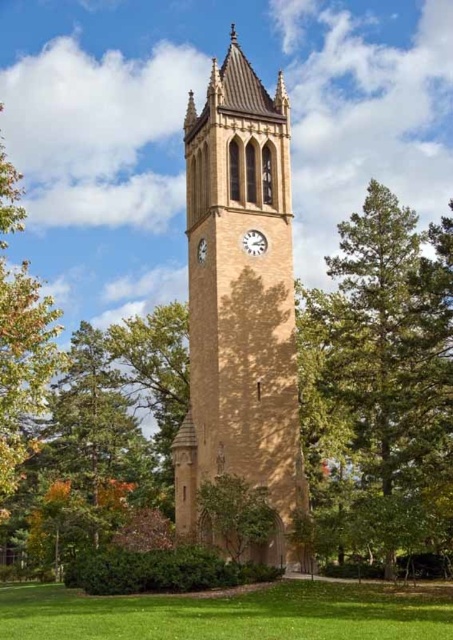
Question: Can you confirm if green leafy tree at lower center is wider than metallic silver clock at center?

Choices:
 (A) yes
 (B) no

Answer: (B)

Question: Observing the image, what is the correct spatial positioning of yellow stone clock tower at center in reference to green leafy tree at left?

Choices:
 (A) above
 (B) below

Answer: (A)

Question: Considering the real-world distances, which object is closest to the metallic silver clock at center?

Choices:
 (A) green leafy tree at right
 (B) green grass at lower center

Answer: (A)

Question: Is green grass at lower center below green leafy tree at left?

Choices:
 (A) yes
 (B) no

Answer: (A)

Question: Among these objects, which one is farthest from the camera?

Choices:
 (A) green grass at lower center
 (B) green leafy tree at right

Answer: (B)

Question: Which object appears farthest from the camera in this image?

Choices:
 (A) yellow stone clock tower at center
 (B) green leafy tree at right
 (C) green leafy tree at left
 (D) green grass at lower center

Answer: (A)